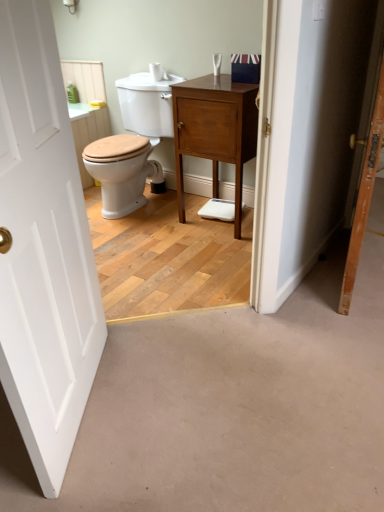
Locate an element on the screen. vacant space in white wooden door at left, which is counted as the second door, starting from the right (from a real-world perspective) is located at coordinates (92, 408).